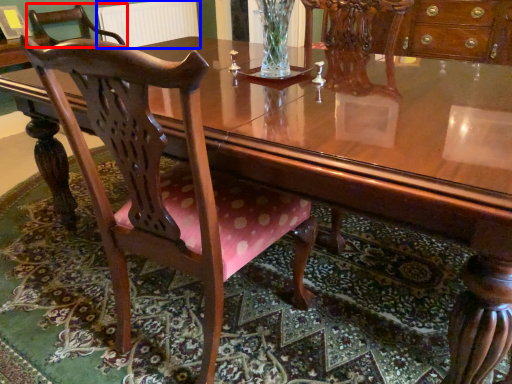
Question: Among these objects, which one is nearest to the camera, chair (highlighted by a red box) or radiator (highlighted by a blue box)?

Choices:
 (A) chair
 (B) radiator

Answer: (A)